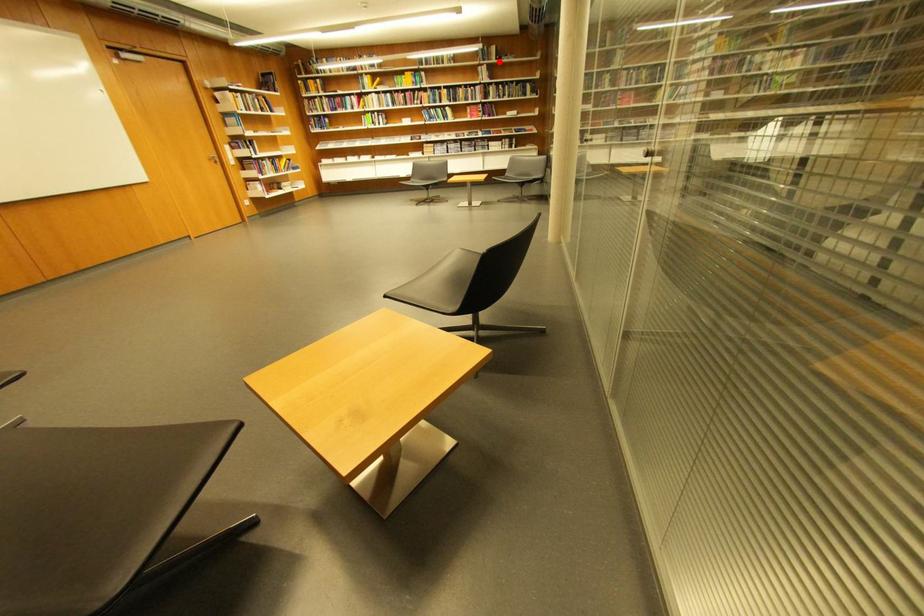
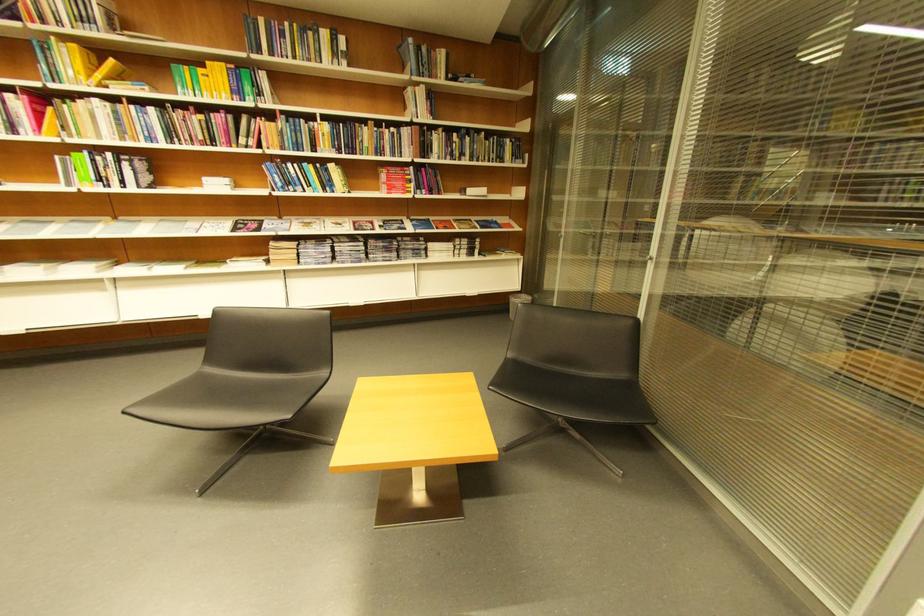
Question: I am providing you with two images of the same scene from different viewpoints. Image1 has a red point marked. In image2, the corresponding 3D location appears at what relative position? Reply with the corresponding letter.

Choices:
 (A) Closer
 (B) Farther

Answer: (B)